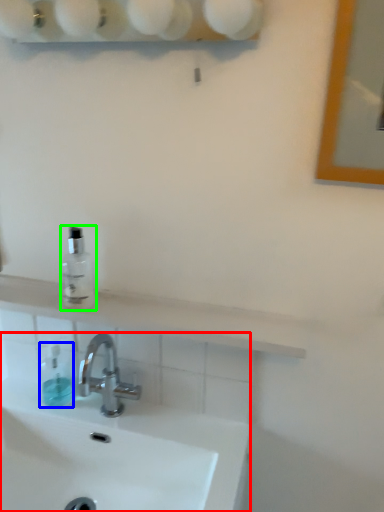
Question: Which is farther away from sink (highlighted by a red box)? toiletry (highlighted by a blue box) or mouthwash (highlighted by a green box)?

Choices:
 (A) toiletry
 (B) mouthwash

Answer: (B)